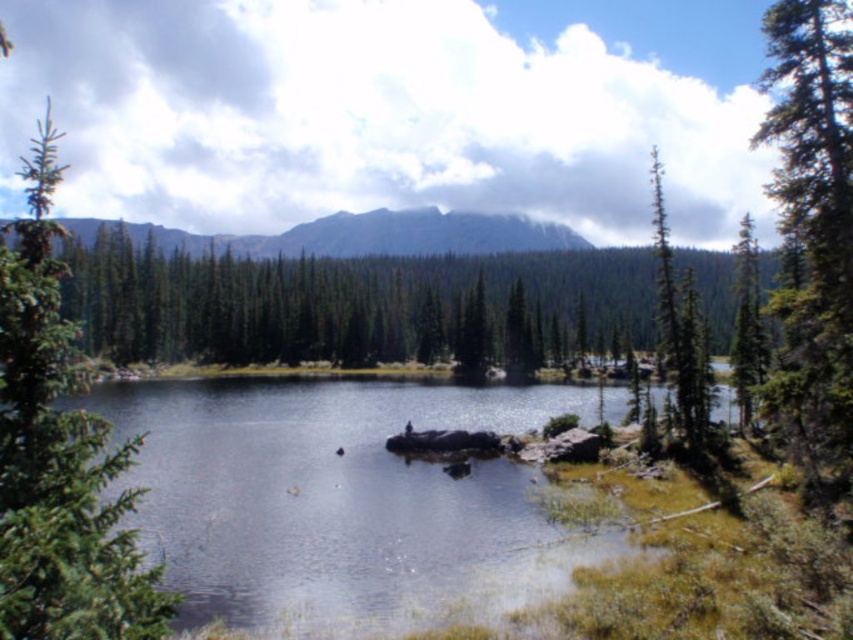
You are standing at the edge of the lake in the serene natural landscape. There is a point marked at coordinates point (306, 429). Can you safely walk to that point without getting wet?

The point (306, 429) is 209.98 feet away from the viewer. Since the lake is calm and the point is on the water surface, you would get wet if you try to walk there.

You are standing at the edge of the lake and see the smooth rock at center and the green matte tree at left. Which object is closer to your right side?

The smooth rock at center is to the right of green matte tree at left, so the smooth rock at center is closer to your right side.

You are an environmental scientist assessing the stability of the landscape. You have a drone that can carry objects up to 1 meter wide. If you need to transport the smooth rock at center and the green textured tree at right, which object would require a larger drone based on their widths?

The smooth rock at center has a larger width than the green textured tree at right, so the drone must be able to carry the smooth rock at center to accommodate its greater width.